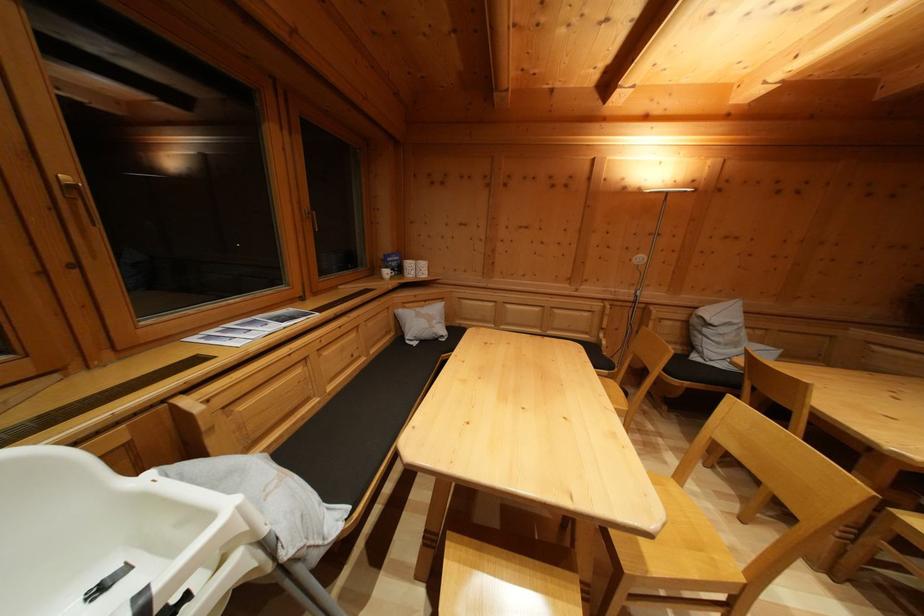
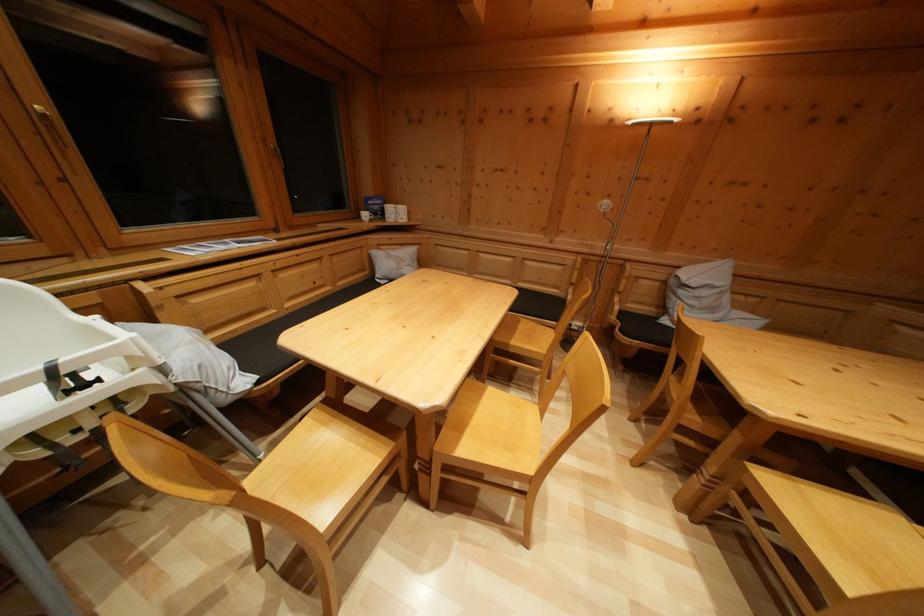
Where in the second image is the point corresponding to pixel 199 339 from the first image?

(176, 251)